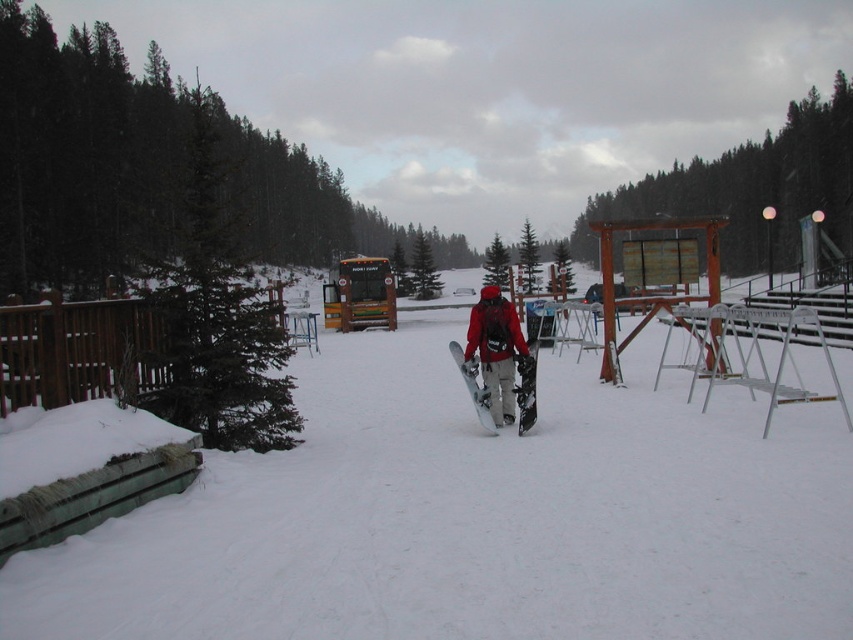
You are standing at the edge of a snowy path and see the matte red snowboarder at center. If you want to call out to them, will your voice likely reach them considering the distance?

The matte red snowboarder at center is 9.61 meters away from you. Since the distance is within a typical shouting range of about 10 meters, your voice should reach them easily.